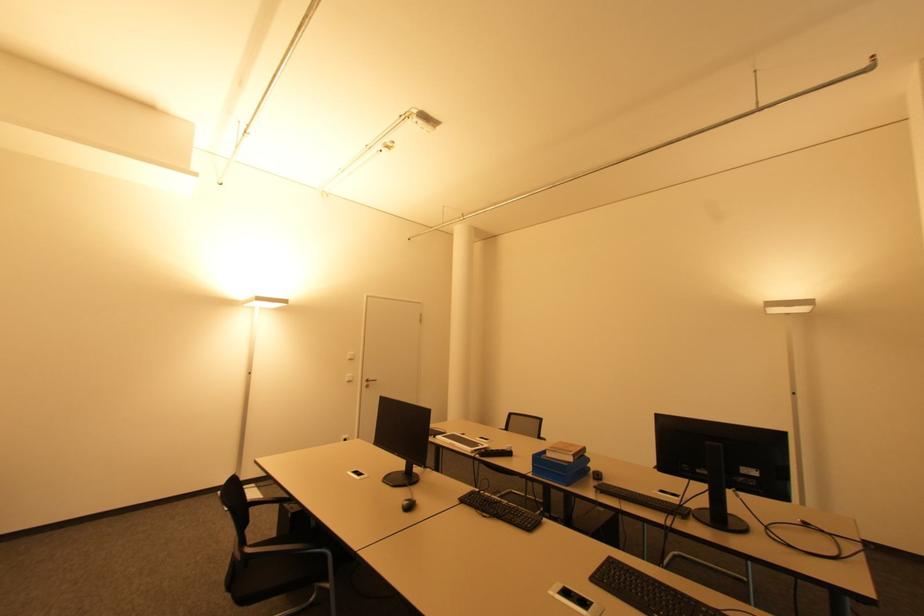
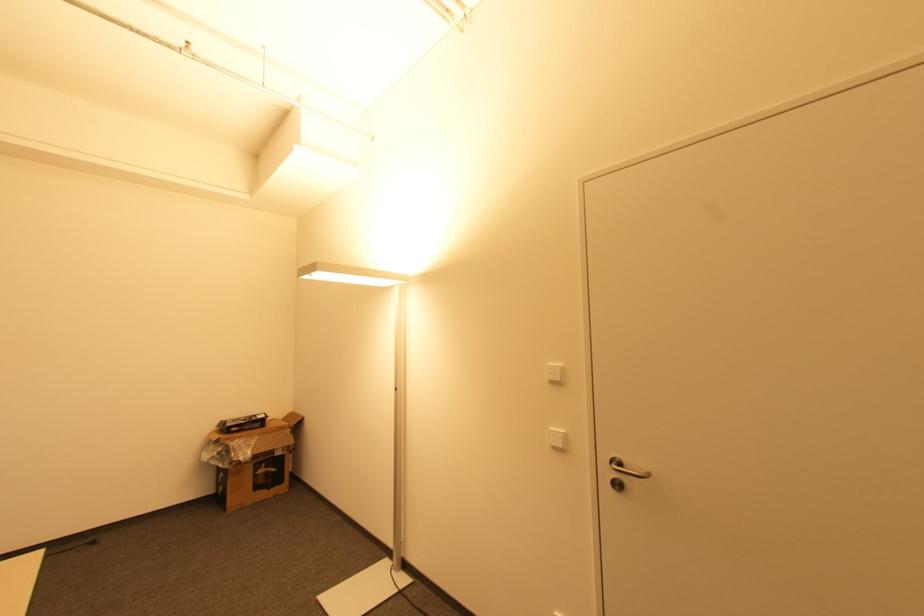
Find the pixel in the second image that matches [351,360] in the first image.

(554, 383)